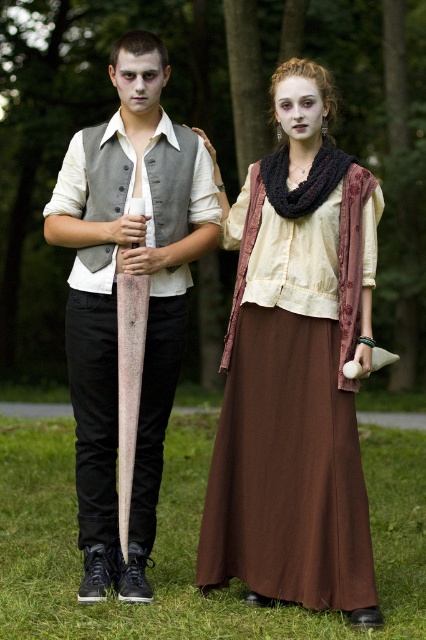
Question: Which object is farther from the camera taking this photo?

Choices:
 (A) matte brown dress at center
 (B) matte gray vest at center

Answer: (B)

Question: Does matte brown dress at center lie in front of matte gray vest at center?

Choices:
 (A) no
 (B) yes

Answer: (B)

Question: Does matte brown dress at center come behind matte gray vest at center?

Choices:
 (A) no
 (B) yes

Answer: (A)

Question: Which point appears farthest from the camera in this image?

Choices:
 (A) (354, 237)
 (B) (132, 176)

Answer: (B)

Question: Which point is farther to the camera?

Choices:
 (A) matte brown dress at center
 (B) matte gray vest at center

Answer: (B)

Question: Can you confirm if matte brown dress at center is positioned below matte gray vest at center?

Choices:
 (A) yes
 (B) no

Answer: (A)